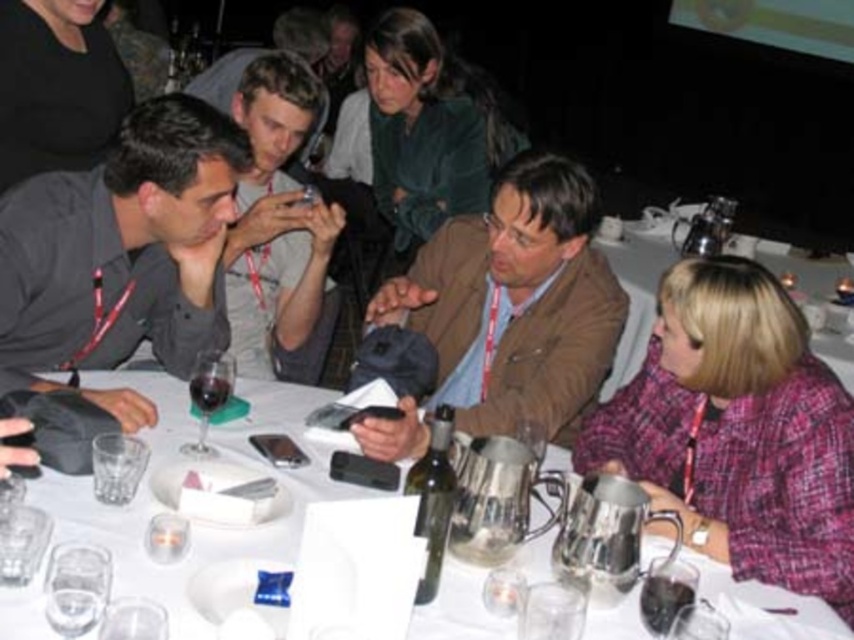
You are a server at a formal event and need to place a new drink order on the table. The transparent glass at lower left is currently on the table. Where should you place the new drink to avoid blocking the brown leather jacket at center?

Since the brown leather jacket at center is taller than the transparent glass at lower left, you should place the new drink on the side of the transparent glass at lower left to avoid blocking the taller brown leather jacket at center.

You are organizing a small event and need to place a decorative item between the brown leather jacket at center and the metallic silver wine at center on the table. Which object should you place the item closer to to ensure it fits within the space between them?

You should place the decorative item closer to the brown leather jacket at center because it has a smaller width than the metallic silver wine at center, allowing more space between them.